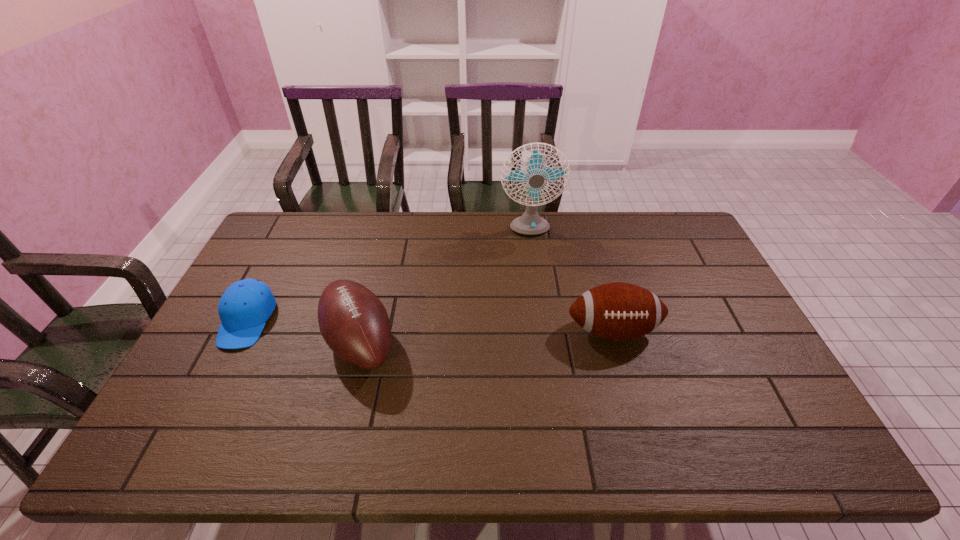
You are a GUI agent. You are given a task and a screenshot of the screen. Output one action in this format:
    pyautogui.click(x=<x>, y=<y>)
    Task: Click on the vacant space that satisfies the following two spatial constraints: 1. on the front-facing side of the leftmost object; 2. on the left side of the third object from right to left
    
    Given the screenshot: What is the action you would take?
    pyautogui.click(x=236, y=342)

Find the location of a particular element. free space in the image that satisfies the following two spatial constraints: 1. on the front-facing side of the second object from left to right; 2. on the left side of the cap is located at coordinates (236, 342).